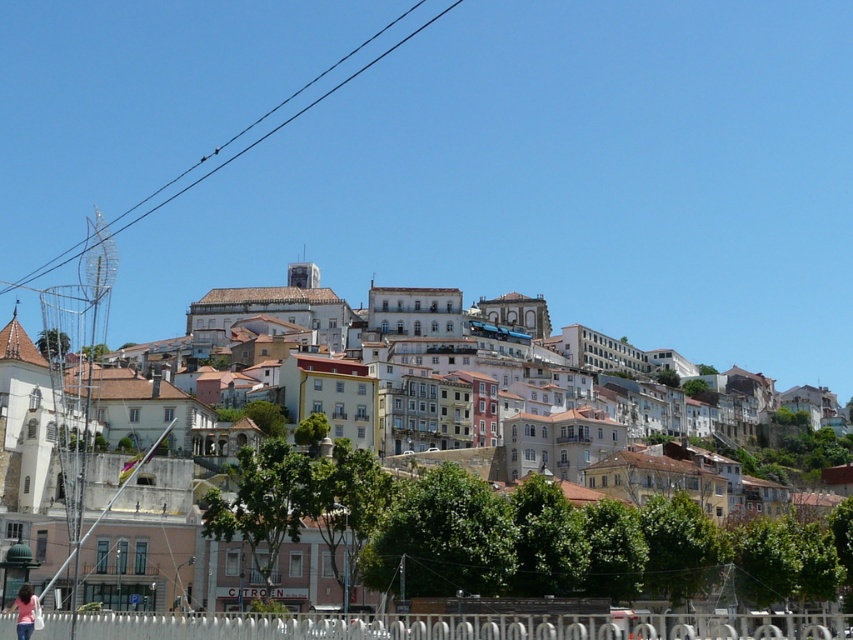
Question: Does white stucco buildings at center have a larger size compared to black wire at upper center?

Choices:
 (A) no
 (B) yes

Answer: (B)

Question: Which point appears farthest from the camera in this image?

Choices:
 (A) (846, 609)
 (B) (293, 113)

Answer: (B)

Question: Is the position of white stucco buildings at center less distant than that of black wire at upper center?

Choices:
 (A) no
 (B) yes

Answer: (B)

Question: Which object is closer to the camera taking this photo?

Choices:
 (A) white stucco buildings at center
 (B) black wire at upper center

Answer: (A)

Question: Which point is closer to the camera taking this photo?

Choices:
 (A) (32, 632)
 (B) (306, 109)

Answer: (A)

Question: Does white stucco buildings at center appear over light blue jeans at lower left?

Choices:
 (A) yes
 (B) no

Answer: (A)